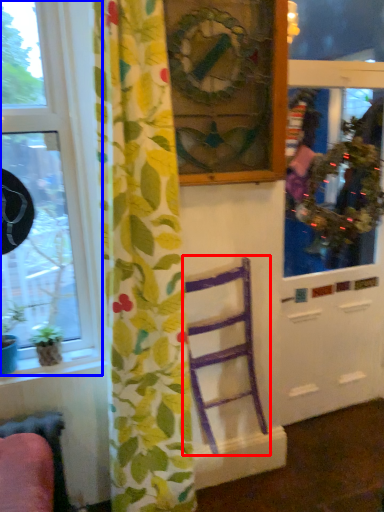
Question: Among these objects, which one is farthest to the camera, furniture (highlighted by a red box) or window (highlighted by a blue box)?

Choices:
 (A) furniture
 (B) window

Answer: (A)